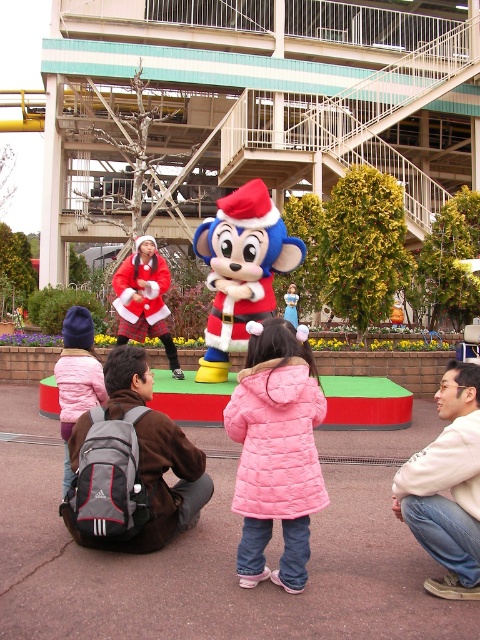
You are a photographer positioned at the origin point of the scene. You need to capture a photo of the pink quilted coat at center. What are the coordinates where you should aim your camera to ensure the coat is centered in the frame?

The coordinates to aim your camera are at point (276, 451) to center the pink quilted coat at center in the frame.

You are a photographer trying to capture the mascot and the building in the background. You notice two points marked on your camera screen at coordinates point (404, 509) and point (67, 332). Which point is closer to your camera lens?

Point (404, 509) is closer to the camera lens than point (67, 332).

You are a delivery robot with a 10 feet reach. You need to pick up the gray fabric backpack at lower left and place it near the velvet plush monkey at center. Can your robotic arm reach the backpack from the monkey?

The distance between the gray fabric backpack at lower left and the velvet plush monkey at center is 16.08 feet. Since your robotic arm only has a 10 feet reach, it cannot reach the backpack from the monkey.